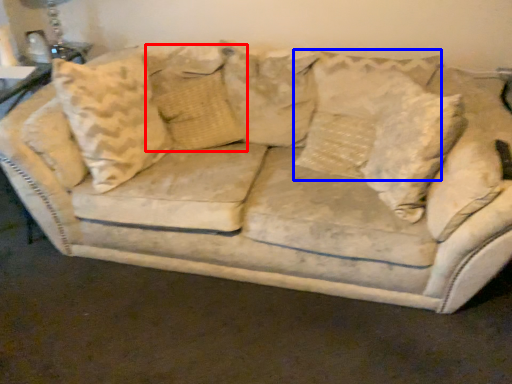
Question: Which point is further to the camera, pillow (highlighted by a red box) or pillow (highlighted by a blue box)?

Choices:
 (A) pillow
 (B) pillow

Answer: (A)